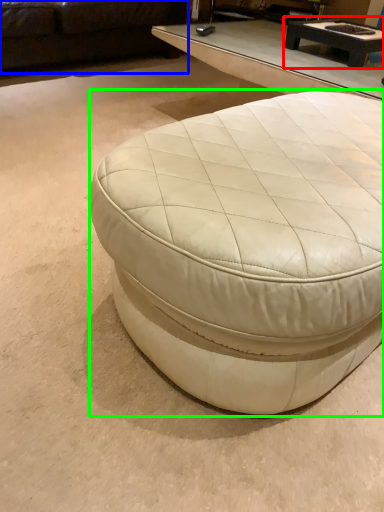
Question: Which object is the closest to the coffee table (highlighted by a red box)? Choose among these: studio couch (highlighted by a blue box) or coffee table (highlighted by a green box).

Choices:
 (A) studio couch
 (B) coffee table

Answer: (B)